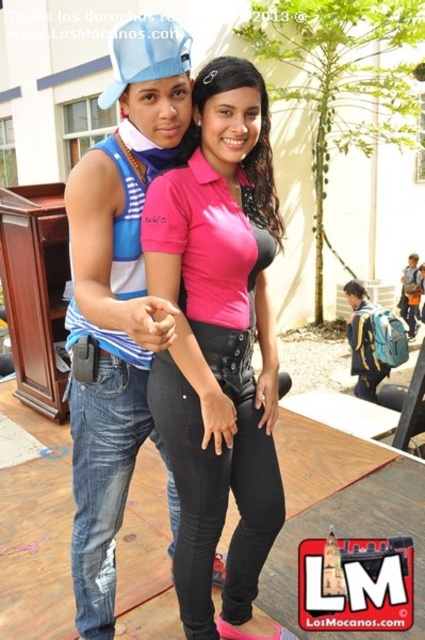
In the scene shown: Who is more forward, [169,474] or [150,33]?

Point [150,33] is more forward.

Who is shorter, blue denim jeans at left or blue matte baseball cap at upper left?

With less height is blue matte baseball cap at upper left.

Does point (108, 356) come farther from viewer compared to point (121, 33)?

Yes, it is behind point (121, 33).

Where is `blue denim jeans at left`? blue denim jeans at left is located at coordinates (116, 298).

Is pink matte shirt at center smaller than blue matte baseball cap at upper left?

Incorrect, pink matte shirt at center is not smaller in size than blue matte baseball cap at upper left.

Between pink matte shirt at center and blue matte baseball cap at upper left, which one has less height?

With less height is blue matte baseball cap at upper left.

Who is more forward, (235, 392) or (150, 51)?

Point (150, 51)

You are a GUI agent. You are given a task and a screenshot of the screen. Output one action in this format:
    pyautogui.click(x=<x>, y=<y>)
    Task: Click on the pink matte shirt at center
    
    Given the screenshot: What is the action you would take?
    pyautogui.click(x=218, y=346)

Is pink matte shirt at center to the left of blue denim jeans at left from the viewer's perspective?

No, pink matte shirt at center is not to the left of blue denim jeans at left.

Can you confirm if pink matte shirt at center is smaller than blue denim jeans at left?

Yes.

Between point (257, 378) and point (167, 52), which one is positioned in front?

Positioned in front is point (167, 52).

The image size is (425, 640). What are the coordinates of `pink matte shirt at center` in the screenshot? It's located at (218, 346).